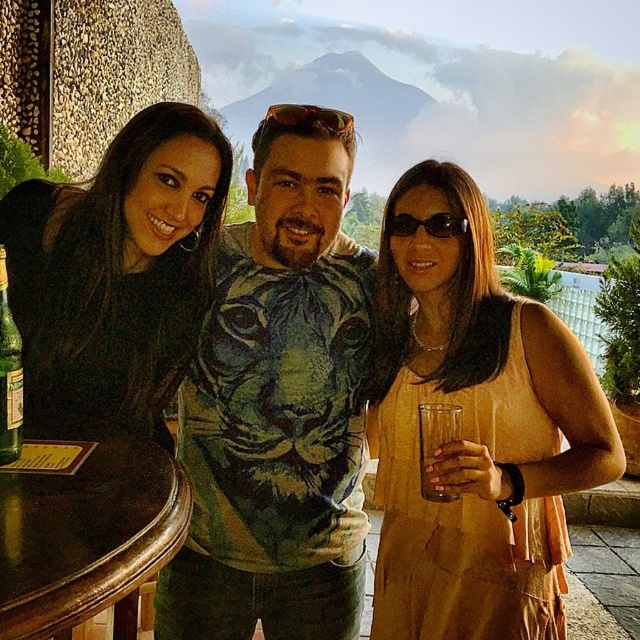
Question: Can you confirm if matte yellow dress at center is thinner than brown wood table at lower left?

Choices:
 (A) no
 (B) yes

Answer: (A)

Question: Which of these objects is positioned farthest from the green matte sunglasses at center?

Choices:
 (A) sunglasses at center
 (B) transparent glass at right

Answer: (B)

Question: Among these objects, which one is nearest to the camera?

Choices:
 (A) matte yellow dress at center
 (B) green fabric shirt at center
 (C) green matte sunglasses at center

Answer: (A)

Question: Is matte yellow dress at center closer to the viewer compared to brown wood table at lower left?

Choices:
 (A) yes
 (B) no

Answer: (B)

Question: Which of the following is the closest to the observer?

Choices:
 (A) (330, 609)
 (B) (394, 221)
 (C) (1, 435)
 (D) (81, 358)

Answer: (C)

Question: Does green glass bottle at left have a smaller size compared to sunglasses at center?

Choices:
 (A) yes
 (B) no

Answer: (A)